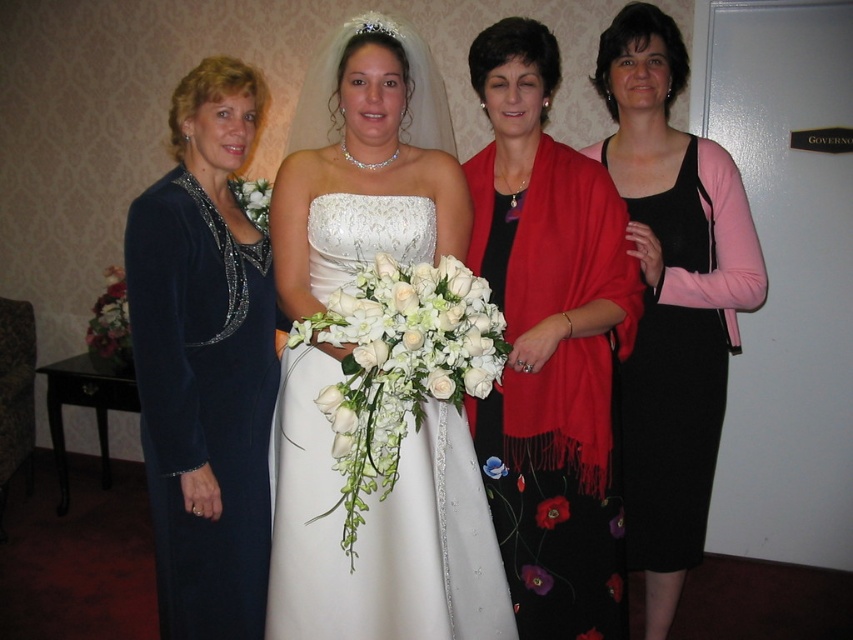
Is black velvet dress at center to the left of black satin dress at right from the viewer's perspective?

No, black velvet dress at center is not to the left of black satin dress at right.

You are a GUI agent. You are given a task and a screenshot of the screen. Output one action in this format:
    pyautogui.click(x=<x>, y=<y>)
    Task: Click on the black velvet dress at center
    The image size is (853, 640).
    Given the screenshot: What is the action you would take?
    pyautogui.click(x=671, y=300)

In order to click on black velvet dress at center in this screenshot , I will do `click(671, 300)`.

Image resolution: width=853 pixels, height=640 pixels. Find the location of `black velvet dress at center`. black velvet dress at center is located at coordinates (671, 300).

Who is positioned more to the left, white satin dress at center or white floral bouquet at center?

white floral bouquet at center is more to the left.

Which is more to the right, white satin dress at center or white floral bouquet at center?

white satin dress at center

Where is `white satin dress at center`? white satin dress at center is located at coordinates (379, 529).

Which of these two, dark blue velvet dress at left or white silk bouquet at center, stands taller?

With more height is dark blue velvet dress at left.

Describe the element at coordinates (206, 360) in the screenshot. The width and height of the screenshot is (853, 640). I see `dark blue velvet dress at left` at that location.

You are a GUI agent. You are given a task and a screenshot of the screen. Output one action in this format:
    pyautogui.click(x=<x>, y=<y>)
    Task: Click on the dark blue velvet dress at left
    This screenshot has width=853, height=640.
    Given the screenshot: What is the action you would take?
    pyautogui.click(x=206, y=360)